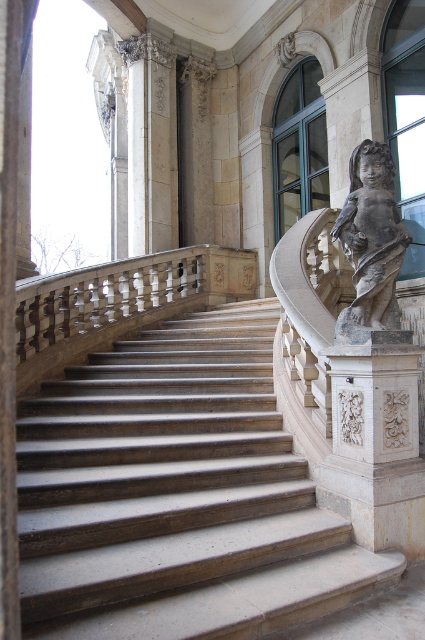
Question: Can you confirm if smooth stone stairs at center is positioned to the right of gray stone cherub at right?

Choices:
 (A) yes
 (B) no

Answer: (B)

Question: Which of the following is the farthest from the observer?

Choices:
 (A) smooth stone stairs at center
 (B) gray stone cherub at right

Answer: (B)

Question: From the image, what is the correct spatial relationship of smooth stone stairs at center in relation to gray stone cherub at right?

Choices:
 (A) above
 (B) below

Answer: (B)

Question: Is smooth stone stairs at center in front of gray stone cherub at right?

Choices:
 (A) yes
 (B) no

Answer: (A)

Question: Which object appears closest to the camera in this image?

Choices:
 (A) smooth stone stairs at center
 (B) gray stone cherub at right

Answer: (A)